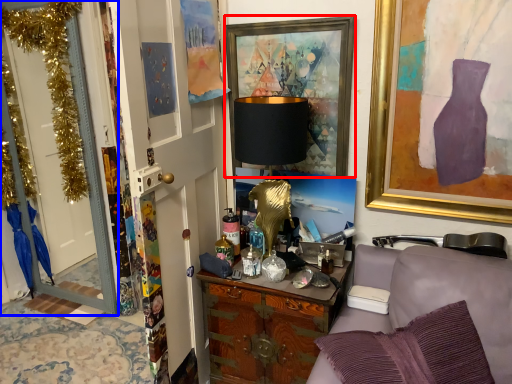
Question: Which of the following is the farthest to the observer, picture frame (highlighted by a red box) or door (highlighted by a blue box)?

Choices:
 (A) picture frame
 (B) door

Answer: (B)